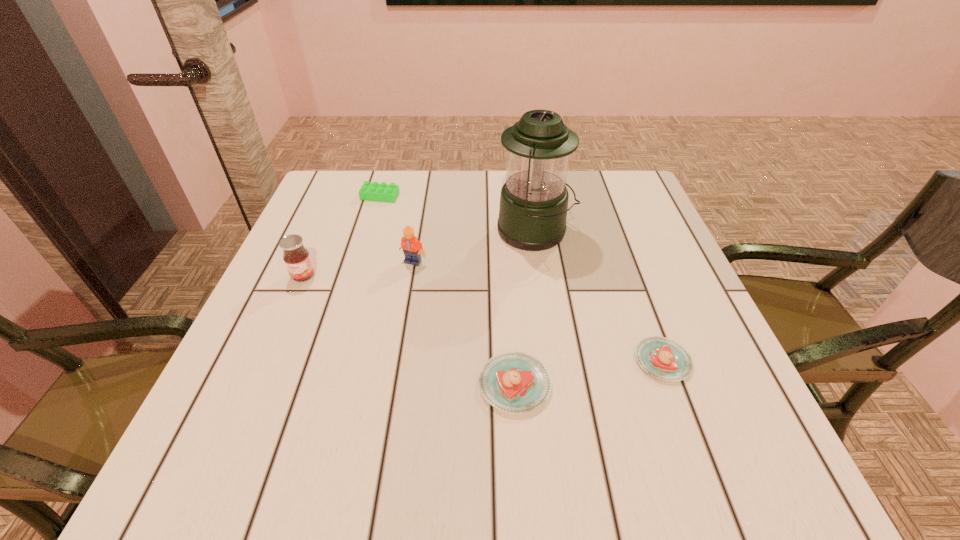
Where is `vacant space at the near right corner`? vacant space at the near right corner is located at coordinates (683, 401).

Locate an element on the screen. The width and height of the screenshot is (960, 540). vacant region between the lantern and the farther Lego is located at coordinates (457, 214).

In order to click on free space that is in between the fourth farthest object and the rightmost object in this screenshot , I will do `click(483, 318)`.

Where is `free space between the fifth object from right to left and the leftmost object`? free space between the fifth object from right to left and the leftmost object is located at coordinates (342, 236).

You are a GUI agent. You are given a task and a screenshot of the screen. Output one action in this format:
    pyautogui.click(x=<x>, y=<y>)
    Task: Click on the free space between the jam and the nearer Lego
    This screenshot has height=540, width=960.
    Given the screenshot: What is the action you would take?
    pyautogui.click(x=358, y=269)

The height and width of the screenshot is (540, 960). What are the coordinates of `free space between the fifth nearest object and the fourth object from right to left` in the screenshot? It's located at pos(474,247).

This screenshot has width=960, height=540. I want to click on empty location between the right Lego and the left pastry, so click(464, 323).

What are the coordinates of `unoccupied area between the jam and the left pastry` in the screenshot? It's located at (409, 330).

Where is `blank region between the third object from left to right and the lantern`? blank region between the third object from left to right and the lantern is located at coordinates (474, 247).

Locate an element on the screen. The width and height of the screenshot is (960, 540). free spot between the fourth nearest object and the tallest object is located at coordinates (474, 247).